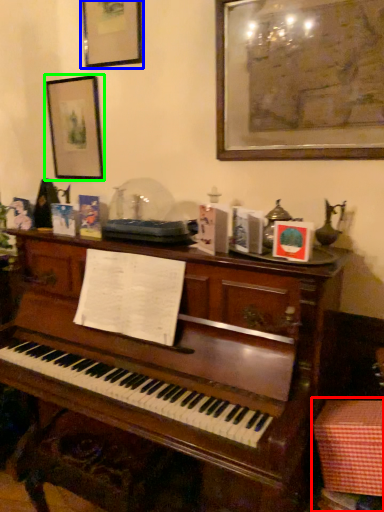
Question: Which is nearer to the table (highlighted by a red box)? picture frame (highlighted by a blue box) or picture frame (highlighted by a green box).

Choices:
 (A) picture frame
 (B) picture frame

Answer: (B)